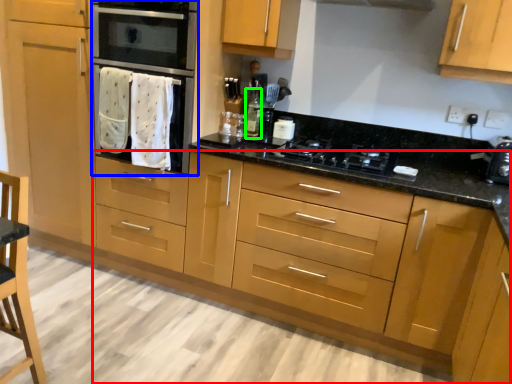
Question: Estimate the real-world distances between objects in this image. Which object is closer to cabinetry (highlighted by a red box), oven (highlighted by a blue box) or bottle (highlighted by a green box)?

Choices:
 (A) oven
 (B) bottle

Answer: (A)